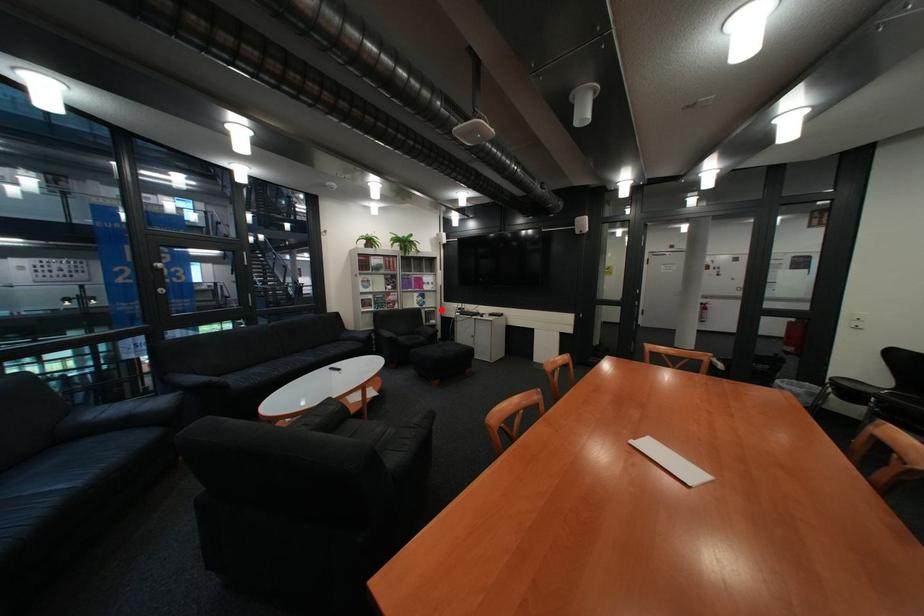
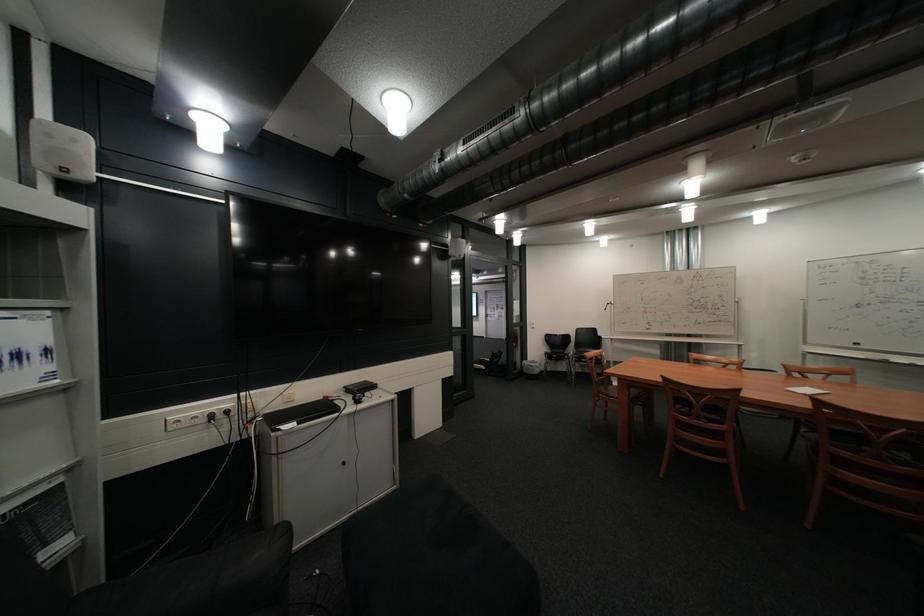
The point at the highlighted location is marked in the first image. Where is the corresponding point in the second image?

(10, 514)